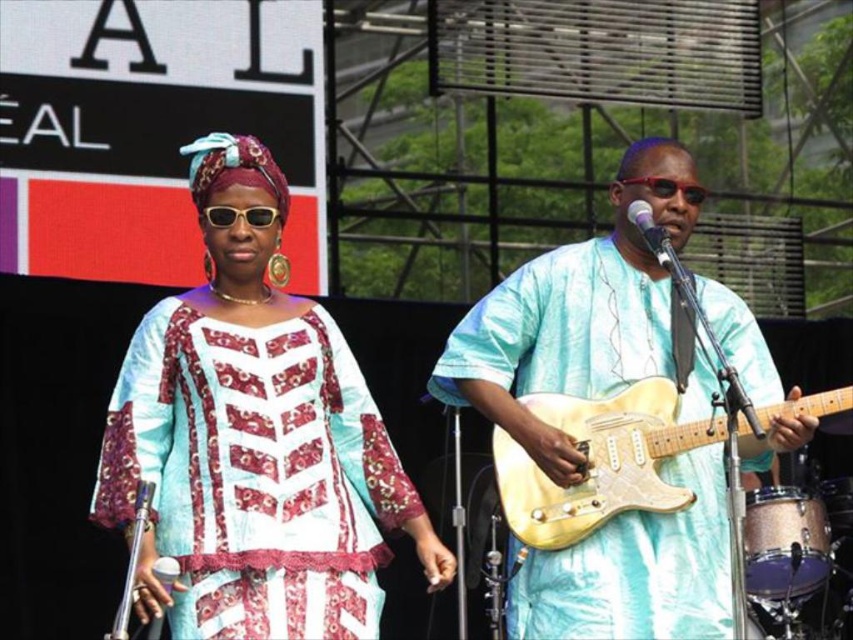
Question: Which of the following is the closest to the observer?

Choices:
 (A) (753, 545)
 (B) (202, 424)
 (C) (590, 410)
 (D) (560, 266)

Answer: (B)

Question: Which is farther from the light yellow wood guitar at center?

Choices:
 (A) light blue fabric guitar at center
 (B) gold metallic drum at lower right
 (C) matte teal and burgundy fabric dress at center

Answer: (C)

Question: Which object is positioned farthest from the gold metallic drum at lower right?

Choices:
 (A) matte teal and burgundy fabric dress at center
 (B) light blue fabric guitar at center

Answer: (A)

Question: Does light blue fabric guitar at center appear on the left side of light yellow wood guitar at center?

Choices:
 (A) no
 (B) yes

Answer: (B)

Question: Does matte teal and burgundy fabric dress at center appear over light blue fabric guitar at center?

Choices:
 (A) yes
 (B) no

Answer: (A)

Question: Can you confirm if matte teal and burgundy fabric dress at center is positioned to the right of light yellow wood guitar at center?

Choices:
 (A) yes
 (B) no

Answer: (B)